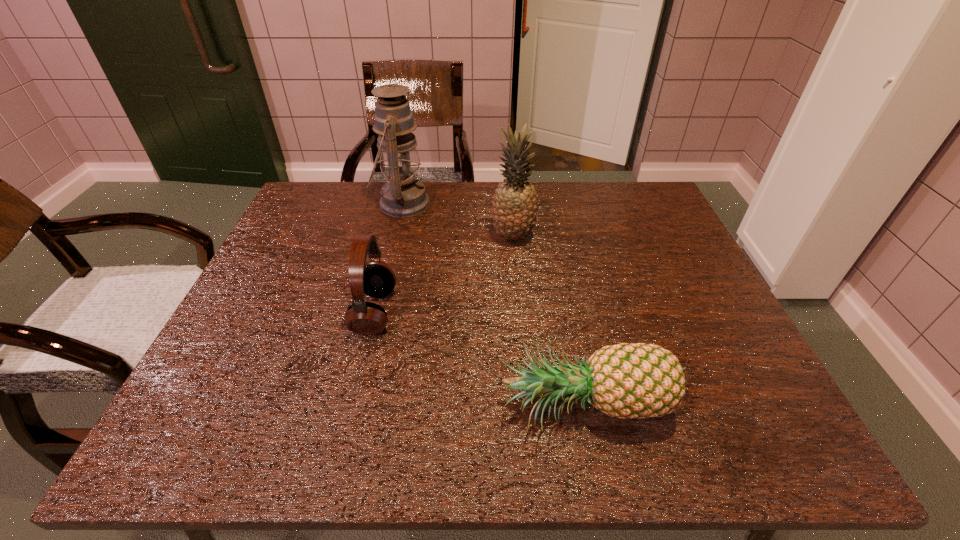
Where is `oil lamp at the far edge`? oil lamp at the far edge is located at coordinates (403, 195).

At what (x,y) coordinates should I click in order to perform the action: click on pineapple that is at the far edge. Please return your answer as a coordinate pair (x, y). The width and height of the screenshot is (960, 540). Looking at the image, I should click on (514, 212).

This screenshot has height=540, width=960. I want to click on object positioned at the near edge, so click(639, 380).

Where is `free spot at the far edge of the desktop`? This screenshot has height=540, width=960. free spot at the far edge of the desktop is located at coordinates pos(577,190).

Identify the location of vacant space at the left edge of the desktop. (328, 249).

Locate an element on the screen. The image size is (960, 540). free space at the right edge of the desktop is located at coordinates (654, 236).

This screenshot has height=540, width=960. In the image, there is a desktop. What are the coordinates of `vacant space at the far left corner` in the screenshot? It's located at (318, 188).

Where is `vacant area at the near left corner of the desktop`? This screenshot has height=540, width=960. vacant area at the near left corner of the desktop is located at coordinates coord(235,455).

In the image, there is a desktop. At what (x,y) coordinates should I click in order to perform the action: click on vacant space at the far right corner. Please return your answer as a coordinate pair (x, y). This screenshot has width=960, height=540. Looking at the image, I should click on (639, 201).

Where is `vacant space at the near right corner`? The width and height of the screenshot is (960, 540). vacant space at the near right corner is located at coordinates (798, 439).